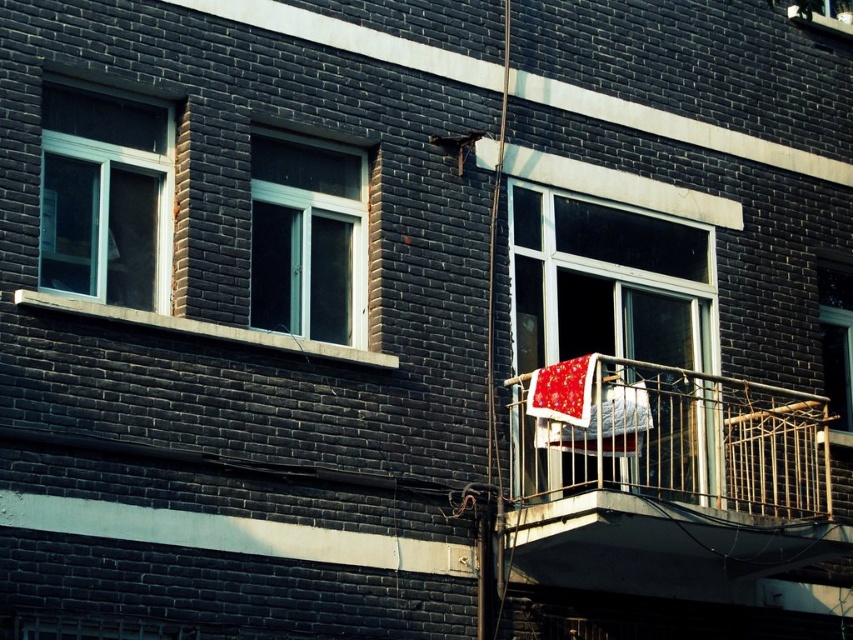
You are an architect assessing the building facade. You notice the metallic railing at right and the clear glass window at center. Which object occupies more space in the image?

The metallic railing at right is bigger than the clear glass window at center, so it occupies more space in the image.

You are a window installer assessing the building facade. You need to replace the clear glass window at center and the white plastic window at center. Which window requires a taller frame for installation?

The clear glass window at center requires a taller frame because it has a greater height compared to the white plastic window at center.

You are standing at the base of the multi story building and want to take a photo of the point at coordinate (x=596, y=348). The camera you are using has a focal length of 50mm and a sensor size of 24mm x 36mm. What is the minimum distance you need to move forward or backward to ensure the point is in focus?

The point at coordinate (x=596, y=348) is 44.62 meters away from the camera. To ensure the point is in focus, you should position the camera at exactly 44.62 meters away from the point.